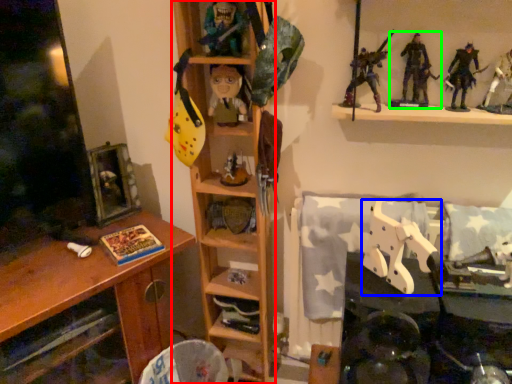
Question: Estimate the real-world distances between objects in this image. Which object is farther from shelf (highlighted by a red box), toy (highlighted by a blue box) or toy (highlighted by a green box)?

Choices:
 (A) toy
 (B) toy

Answer: (B)